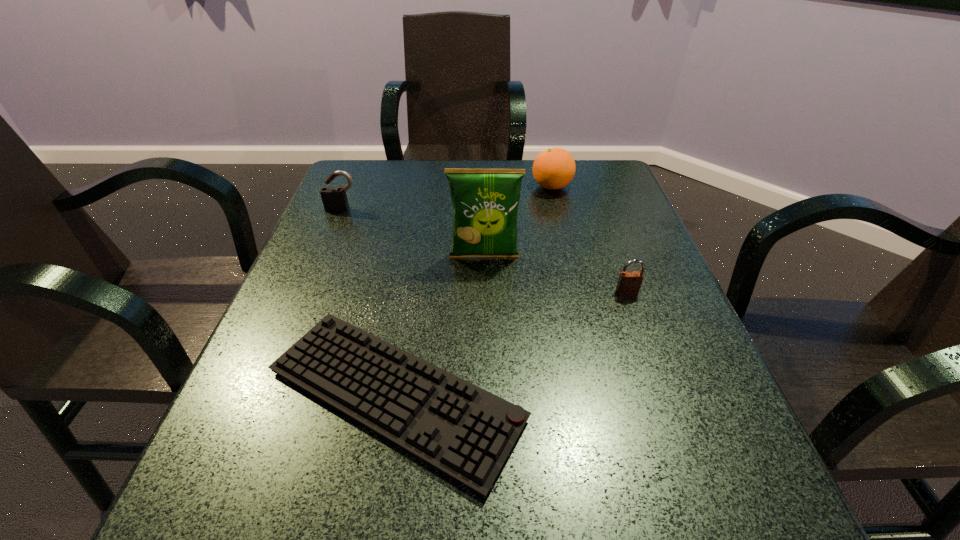
This screenshot has height=540, width=960. In order to click on empty location between the third nearest object and the orange in this screenshot , I will do `click(518, 221)`.

The height and width of the screenshot is (540, 960). Identify the location of free space between the shortest object and the fourth object from left to right. (473, 291).

Locate an element on the screen. empty space between the third nearest object and the right padlock is located at coordinates (556, 274).

The image size is (960, 540). I want to click on empty space that is in between the nearest object and the farthest object, so click(x=473, y=291).

The width and height of the screenshot is (960, 540). What are the coordinates of `vacant point located between the second object from right to left and the nearest object` in the screenshot? It's located at (473, 291).

Where is `vacant area that lies between the taller padlock and the orange`? This screenshot has height=540, width=960. vacant area that lies between the taller padlock and the orange is located at coordinates (447, 198).

Where is `free space between the farthest object and the crisp (potato chip)`? The height and width of the screenshot is (540, 960). free space between the farthest object and the crisp (potato chip) is located at coordinates (518, 221).

Identify the location of free space between the nearest object and the nearer padlock. The width and height of the screenshot is (960, 540). (511, 343).

Locate which object ranks fourth in proximity to the orange. Please provide its 2D coordinates. Your answer should be formatted as a tuple, i.e. [(x, y)], where the tuple contains the x and y coordinates of a point satisfying the conditions above.

[(334, 199)]

Point out which object is positioned as the third nearest to the fourth tallest object. Please provide its 2D coordinates. Your answer should be formatted as a tuple, i.e. [(x, y)], where the tuple contains the x and y coordinates of a point satisfying the conditions above.

[(554, 168)]